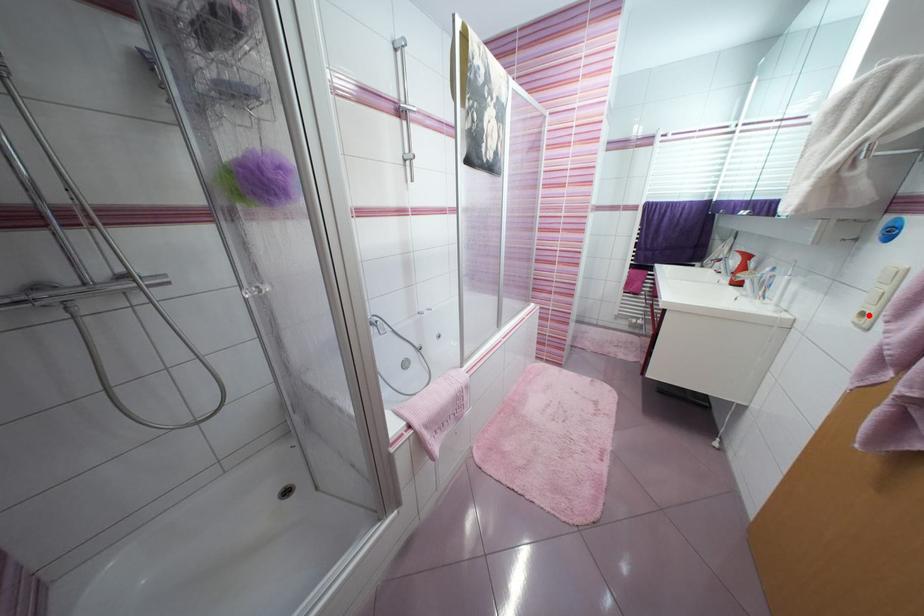
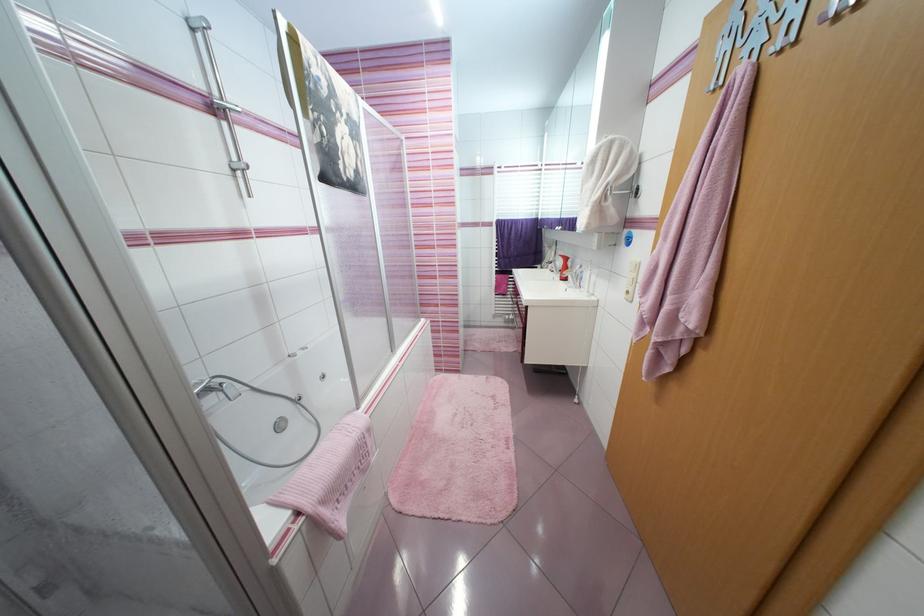
The point at the highlighted location is marked in the first image. Where is the corresponding point in the second image?

(633, 293)